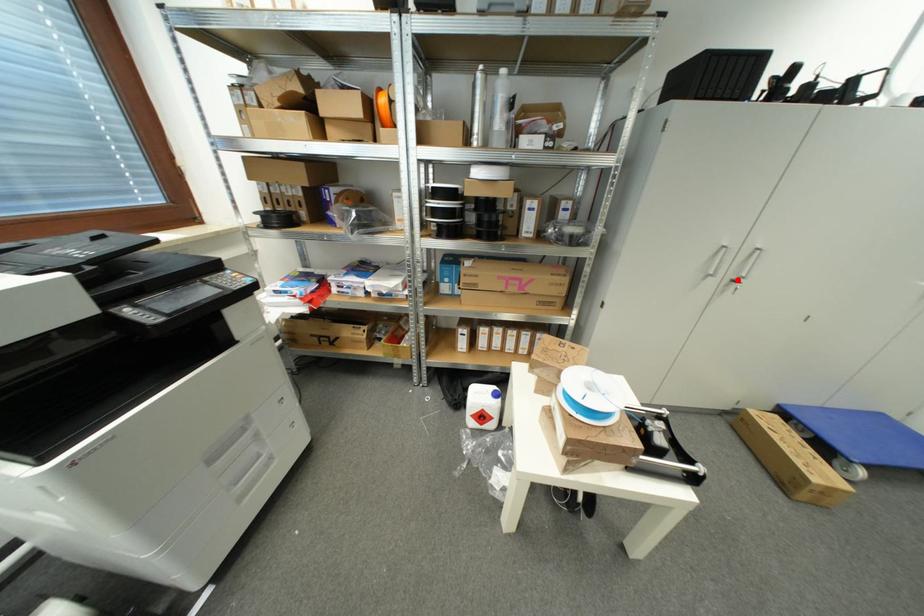
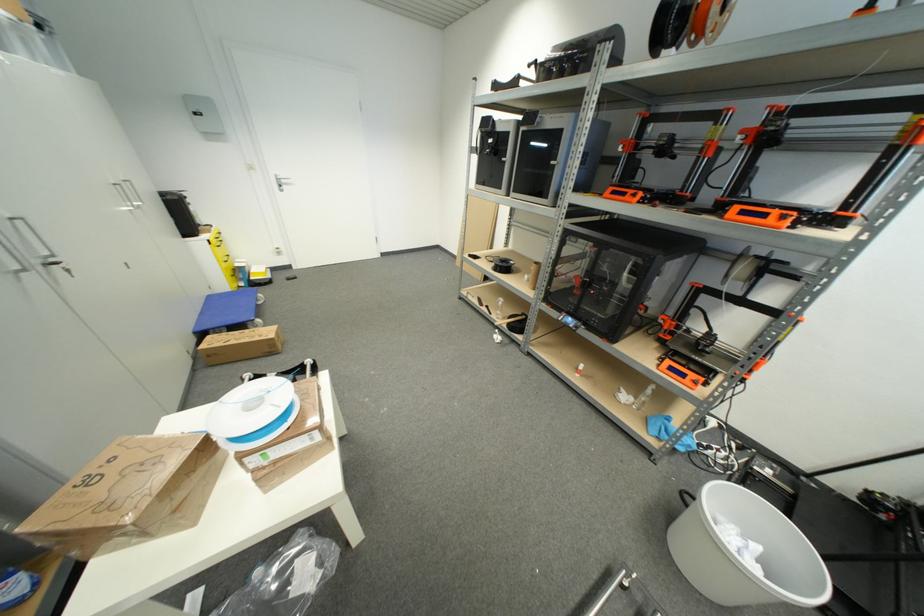
Find the pixel in the second image that matches the highlighted location in the first image.

(43, 264)